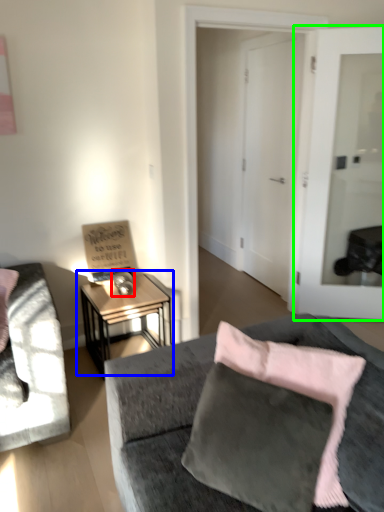
Question: Which object is positioned closest to table lamp (highlighted by a red box)? Select from table (highlighted by a blue box) and door (highlighted by a green box).

Choices:
 (A) table
 (B) door

Answer: (A)